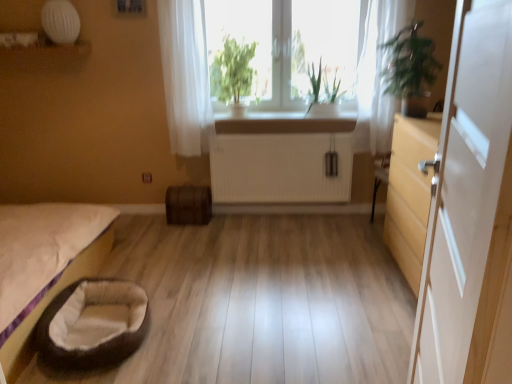
At what (x,y) coordinates should I click in order to perform the action: click on blank space situated above white ribbed radiator at center (from a real-world perspective). Please return your answer as a coordinate pair (x, y). Looking at the image, I should click on (298, 131).